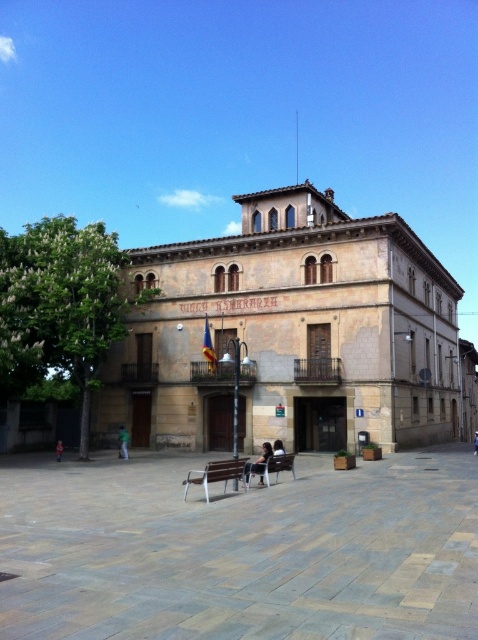
Is wooden bench at center taller than dark blue jeans at lower left?

No.

This screenshot has width=478, height=640. Describe the element at coordinates (271, 467) in the screenshot. I see `wooden bench at center` at that location.

The image size is (478, 640). Identify the location of wooden bench at center. (271, 467).

Who is lower down, wooden bench at center or green fabric person at center?

green fabric person at center

Who is more distant from viewer, (276, 456) or (119, 440)?

Point (119, 440)

At what (x,y) coordinates should I click in order to perform the action: click on wooden bench at center. Please return your answer as a coordinate pair (x, y). Looking at the image, I should click on (271, 467).

Is dark brown leather bench at center smaller than green fabric person at center?

Actually, dark brown leather bench at center might be larger than green fabric person at center.

Does point (267, 460) lie behind point (123, 451)?

That is False.

Where is `dark brown leather bench at center`? The image size is (478, 640). dark brown leather bench at center is located at coordinates (259, 461).